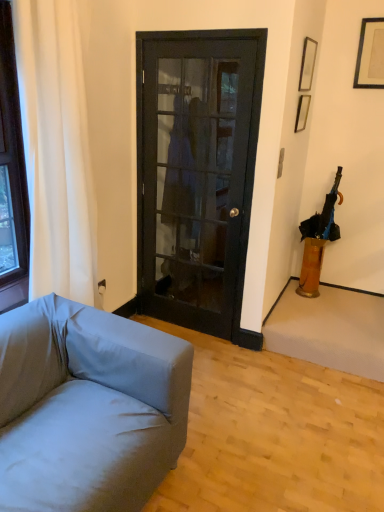
Question: Is the position of black matte picture frame at upper right, the 3th picture frame in the left-to-right sequence, more distant than that of black fabric umbrella at right?

Choices:
 (A) no
 (B) yes

Answer: (A)

Question: Does black matte picture frame at upper right, the 3th picture frame in the left-to-right sequence, have a lesser width compared to black fabric umbrella at right?

Choices:
 (A) yes
 (B) no

Answer: (A)

Question: From the image's perspective, is black matte picture frame at upper right, the 1th picture frame when ordered from right to left, beneath black fabric umbrella at right?

Choices:
 (A) no
 (B) yes

Answer: (A)

Question: Is black matte picture frame at upper right, the 1th picture frame when ordered from right to left, at the left side of black fabric umbrella at right?

Choices:
 (A) yes
 (B) no

Answer: (B)

Question: Is black matte picture frame at upper right, the 3th picture frame in the left-to-right sequence, looking in the opposite direction of black fabric umbrella at right?

Choices:
 (A) no
 (B) yes

Answer: (A)

Question: Is black matte picture frame at upper right, the 3th picture frame in the left-to-right sequence, beside black fabric umbrella at right?

Choices:
 (A) yes
 (B) no

Answer: (B)

Question: Is black fabric umbrella at right taller than black glass door at center?

Choices:
 (A) no
 (B) yes

Answer: (A)

Question: Can you confirm if black fabric umbrella at right is bigger than black glass door at center?

Choices:
 (A) yes
 (B) no

Answer: (B)

Question: Would you consider black fabric umbrella at right to be distant from black glass door at center?

Choices:
 (A) yes
 (B) no

Answer: (A)

Question: Does black fabric umbrella at right appear on the right side of black glass door at center?

Choices:
 (A) no
 (B) yes

Answer: (B)

Question: From a real-world perspective, is black fabric umbrella at right positioned under black glass door at center based on gravity?

Choices:
 (A) no
 (B) yes

Answer: (B)

Question: Does black fabric umbrella at right come in front of black glass door at center?

Choices:
 (A) no
 (B) yes

Answer: (A)

Question: Is white fabric curtain at left wider than black matte picture frame at upper right, the 1th picture frame when ordered from right to left?

Choices:
 (A) yes
 (B) no

Answer: (A)